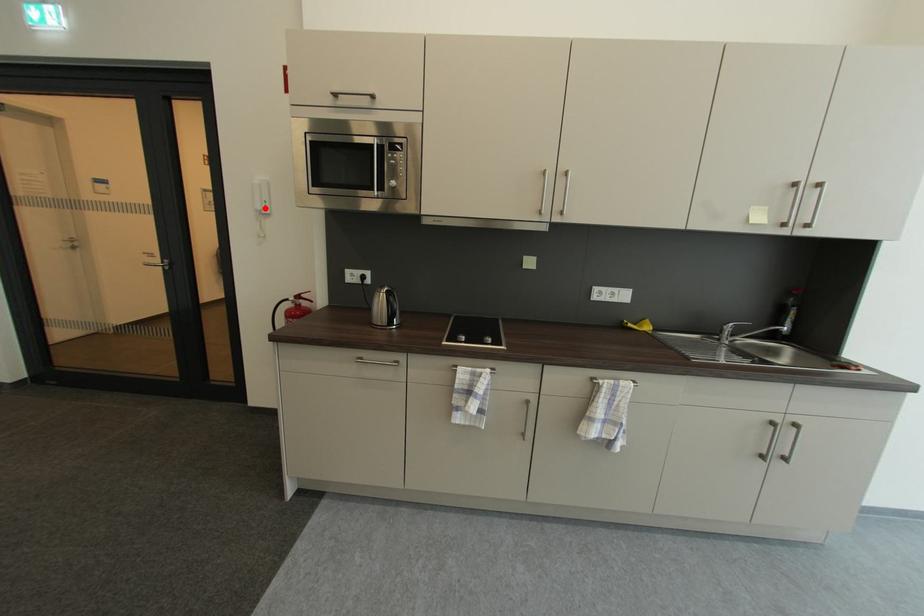
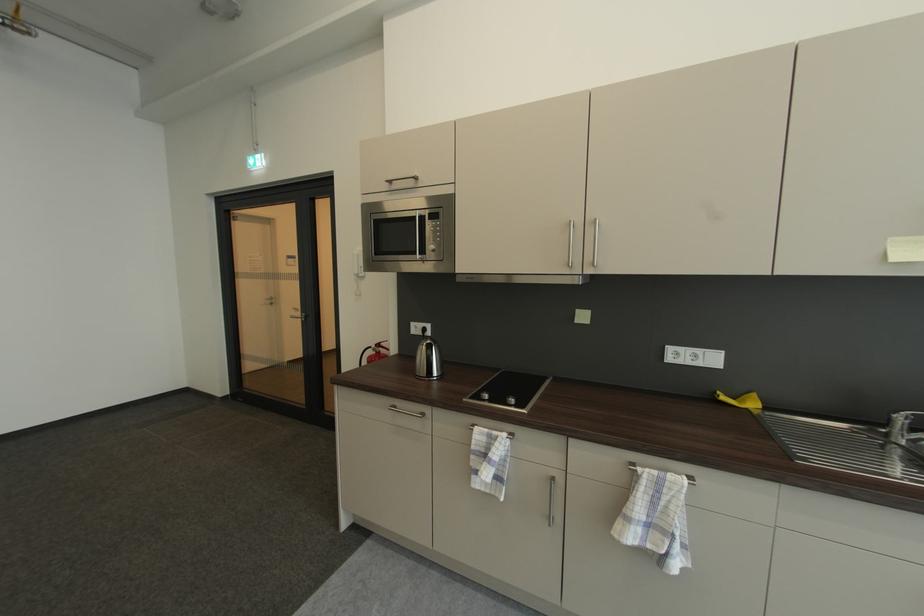
Where in the second image is the point corresponding to the highlighted location from the first image?

(362, 273)